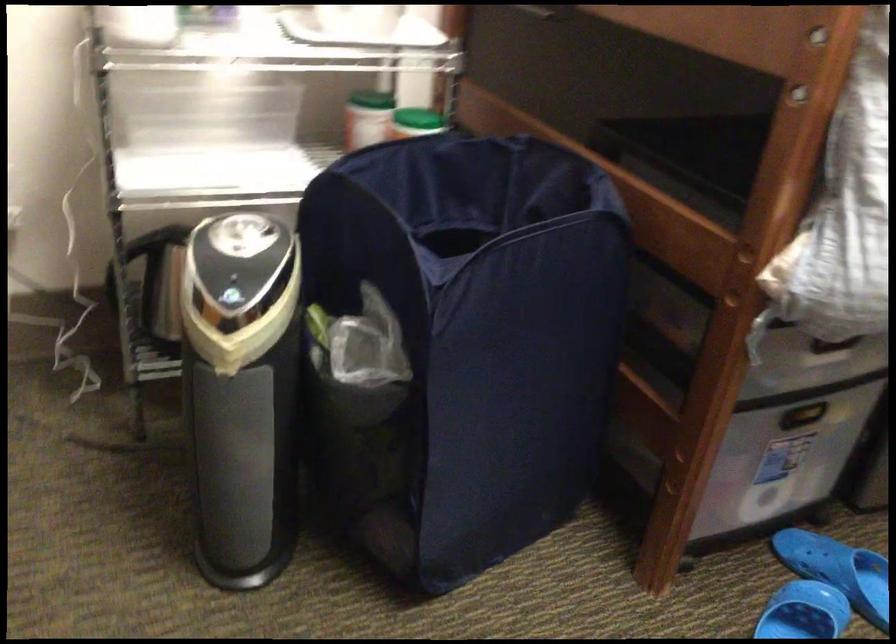
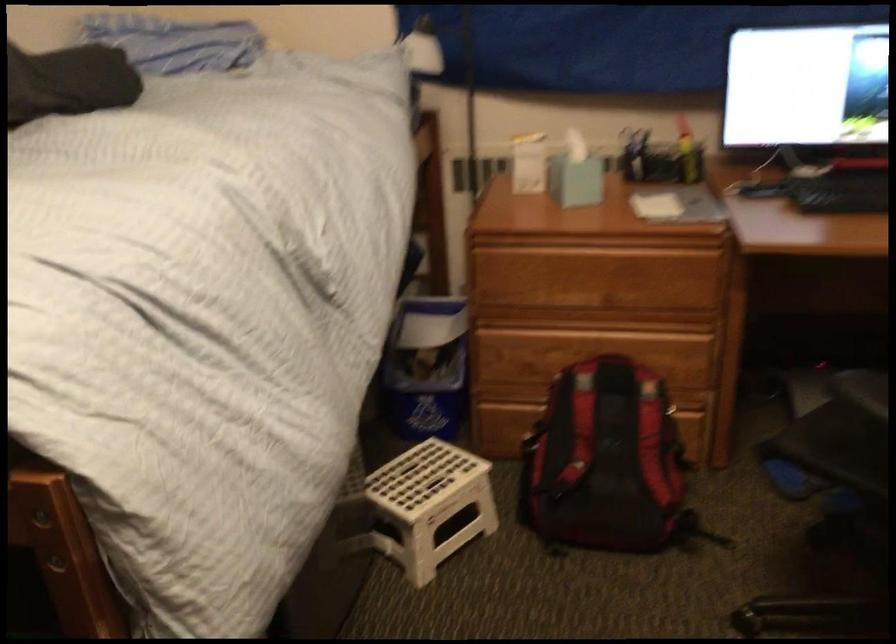
In the second image, find the point that corresponds to pixel 806 104 in the first image.

(56, 567)